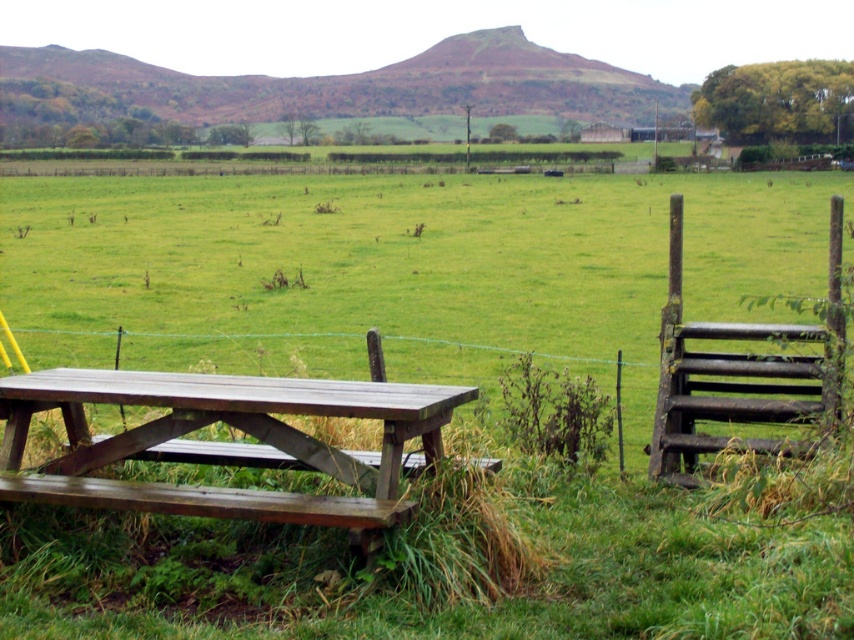
Question: Is the position of green wood field at center more distant than that of wooden picnic table at lower left?

Choices:
 (A) no
 (B) yes

Answer: (B)

Question: Where is green wood field at center located in relation to wooden picnic table at lower left in the image?

Choices:
 (A) above
 (B) below

Answer: (A)

Question: Which object is positioned farthest from the wooden picnic table at lower left?

Choices:
 (A) rustic wooden gate at right
 (B) green wood field at center

Answer: (B)

Question: Can you confirm if green wood field at center is positioned below rustic wooden gate at right?

Choices:
 (A) no
 (B) yes

Answer: (A)

Question: Which object is farther from the camera taking this photo?

Choices:
 (A) rustic wooden gate at right
 (B) green wood field at center

Answer: (B)

Question: Which object is closer to the camera taking this photo?

Choices:
 (A) rustic wooden gate at right
 (B) wooden picnic table at lower left

Answer: (B)